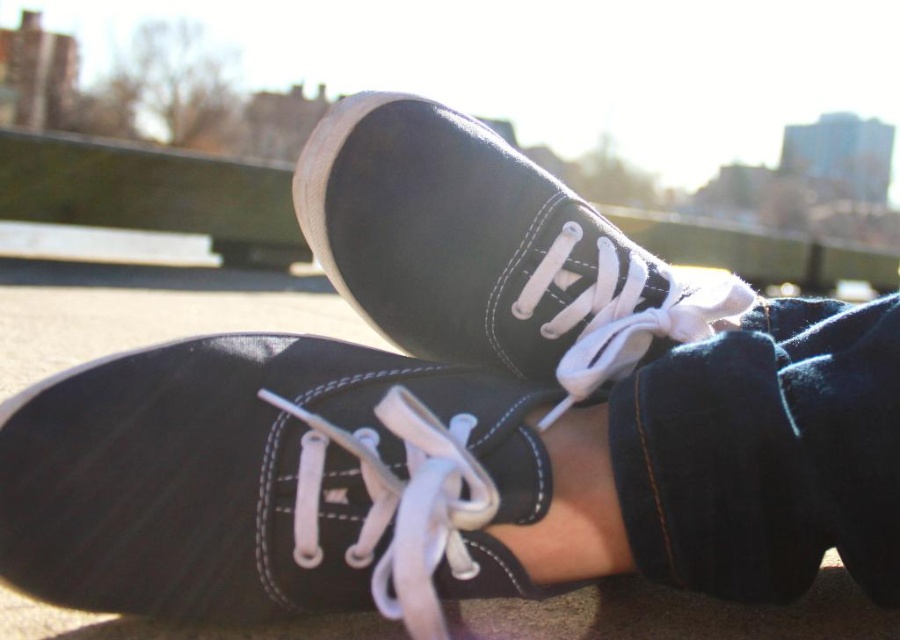
Does matte black shoe at center have a larger size compared to matte black sneaker at center?

No.

Is matte black shoe at center positioned before matte black sneaker at center?

Yes, matte black shoe at center is closer to the viewer.

Is point (68, 390) farther from camera compared to point (729, 300)?

That is False.

This screenshot has height=640, width=900. Find the location of `matte black shoe at center`. matte black shoe at center is located at coordinates (225, 474).